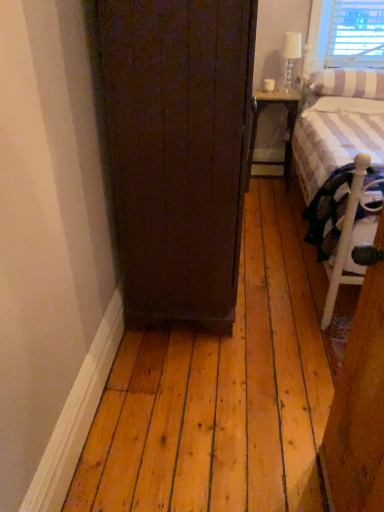
What are the coordinates of `vacant space in front of metallic gray nightstand at right` in the screenshot? It's located at (266, 196).